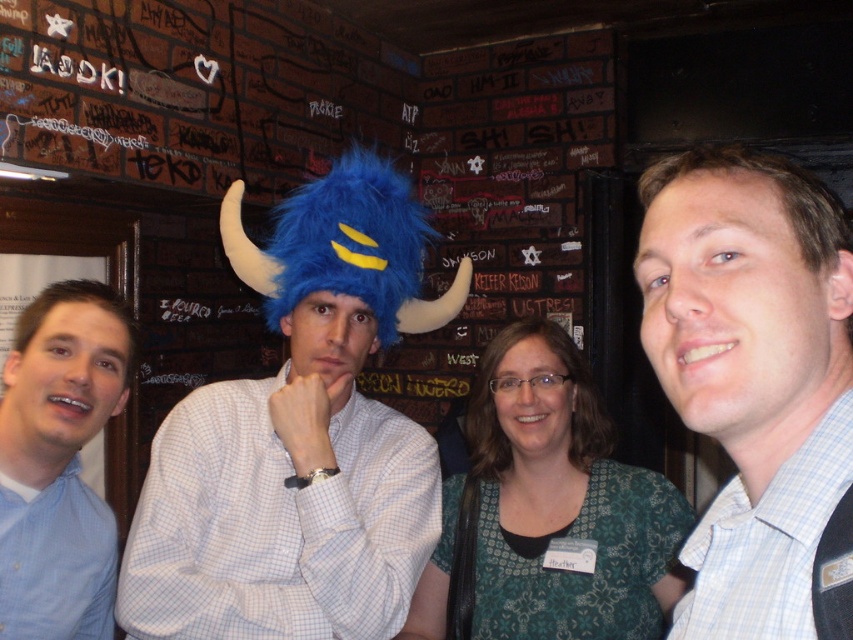
You are observing a group of people standing against a graffiti wall. You see a blue fuzzy hat at center and a blue fuzzy hat at left. Which blue fuzzy hat is positioned higher?

The blue fuzzy hat at center is positioned higher than the blue fuzzy hat at left.